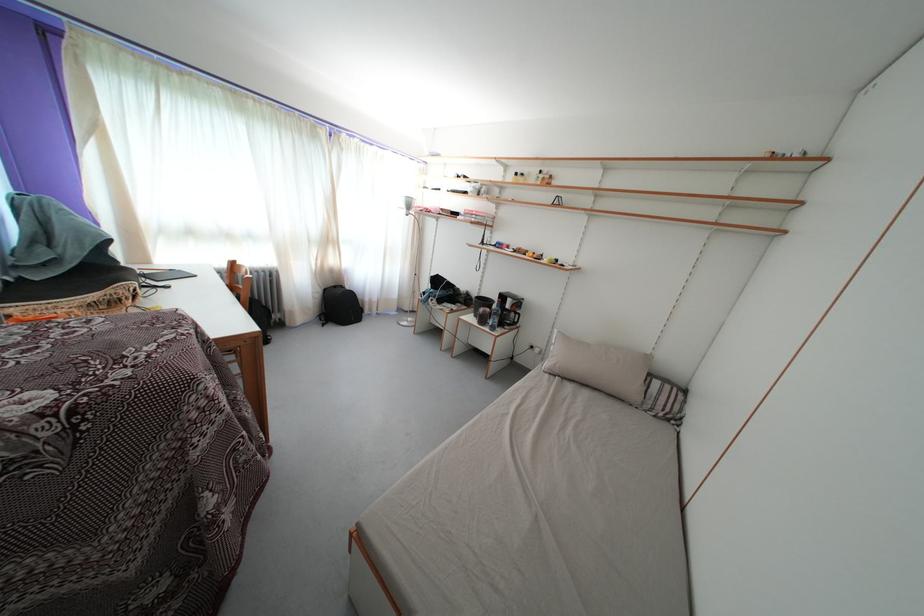
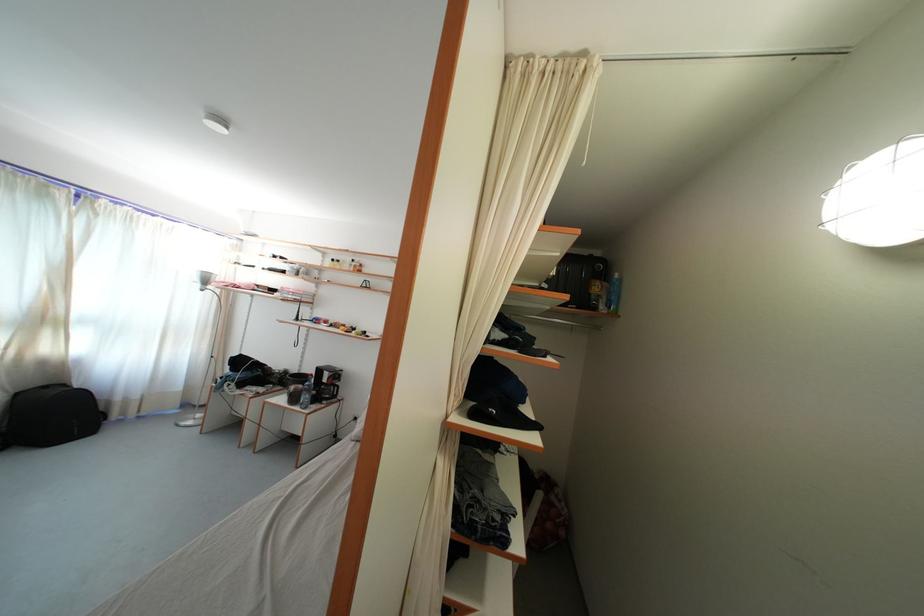
Find the pixel in the second image that matches (x=332, y=296) in the first image.

(23, 400)